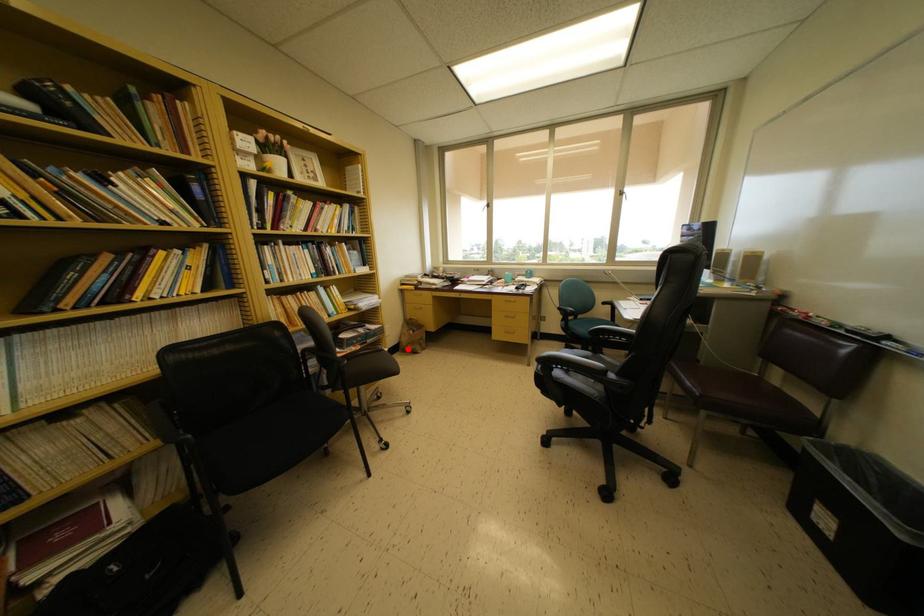
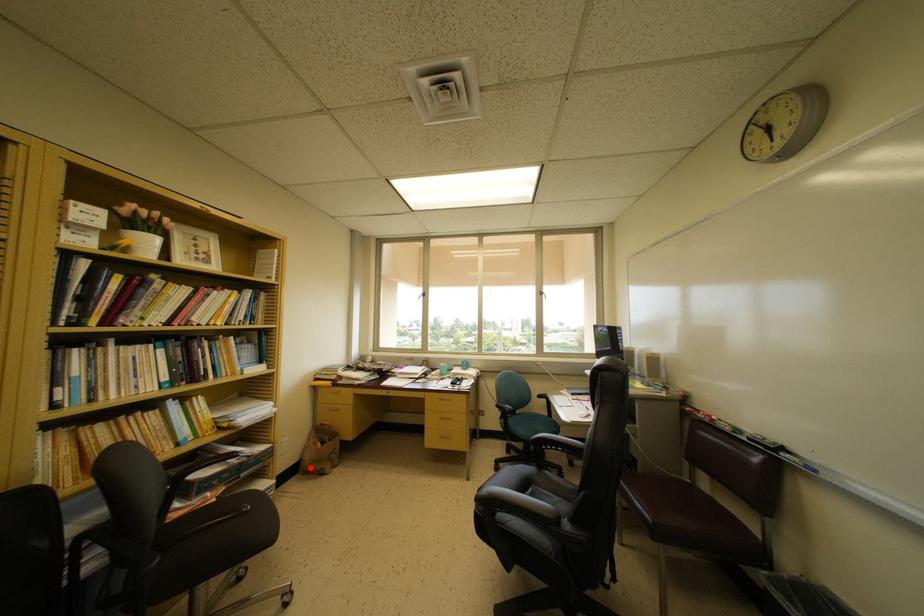
Based on the photo, I am providing you with two images of the same scene from different viewpoints. A red point is marked on the first image and another point is marked on the second image. Is the red point in image1 aligned with the point shown in image2?

Yes